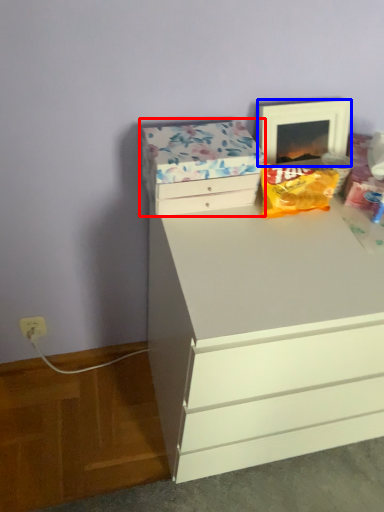
Question: Which object is further to the camera taking this photo, storage box (highlighted by a red box) or picture frame (highlighted by a blue box)?

Choices:
 (A) storage box
 (B) picture frame

Answer: (B)